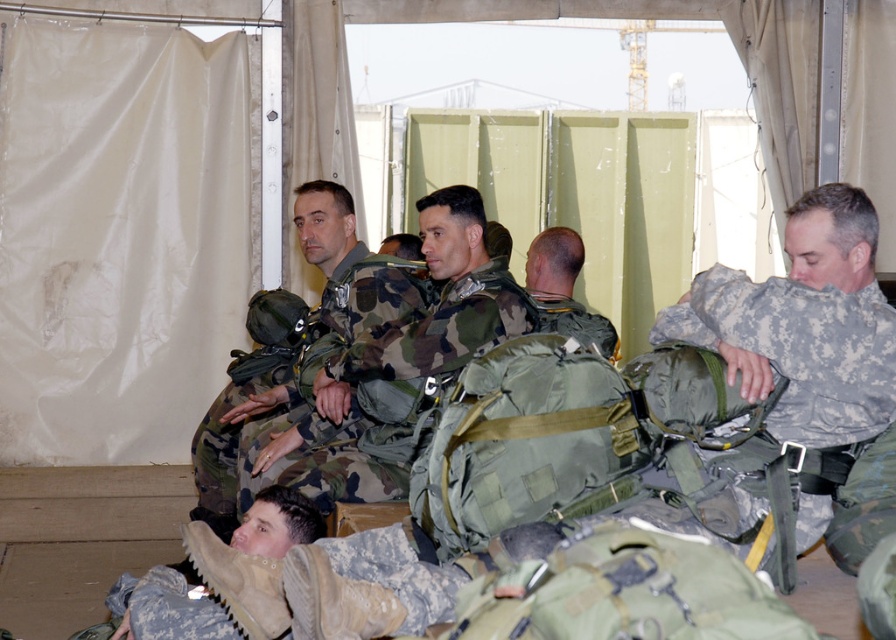
Question: Which point appears closest to the camera in this image?

Choices:
 (A) (419, 332)
 (B) (347, 273)
 (C) (565, 240)
 (D) (291, 492)

Answer: (D)

Question: Which object is the closest to the camouflage uniform at lower left?

Choices:
 (A) camouflage fabric uniform at center
 (B) camouflage fabric backpack at center
 (C) camouflage uniform at center

Answer: (C)

Question: Is camouflage uniform at center to the right of camouflage uniform at lower left from the viewer's perspective?

Choices:
 (A) yes
 (B) no

Answer: (A)

Question: Considering the relative positions of camouflage fabric uniform at center and green camouflage backpack at center in the image provided, where is camouflage fabric uniform at center located with respect to green camouflage backpack at center?

Choices:
 (A) right
 (B) left

Answer: (B)

Question: Which point is farther to the camera?

Choices:
 (A) (308, 515)
 (B) (540, 296)
 (C) (407, 330)

Answer: (B)

Question: Can you confirm if camouflage uniform at lower left is wider than camouflage fabric backpack at center?

Choices:
 (A) yes
 (B) no

Answer: (B)